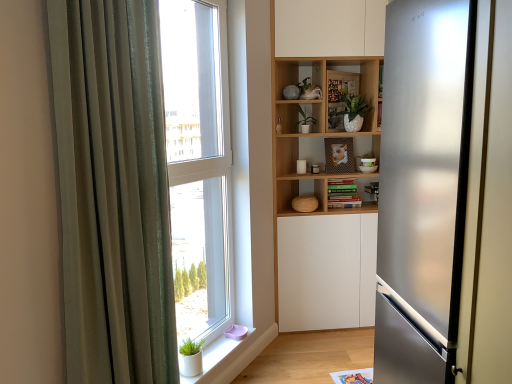
Question: Is transparent glass window at center turned away from white matte window sill at lower left?

Choices:
 (A) yes
 (B) no

Answer: (B)

Question: Is transparent glass window at center bigger than white matte window sill at lower left?

Choices:
 (A) no
 (B) yes

Answer: (B)

Question: Can you confirm if transparent glass window at center is smaller than white matte window sill at lower left?

Choices:
 (A) no
 (B) yes

Answer: (A)

Question: Are transparent glass window at center and white matte window sill at lower left far apart?

Choices:
 (A) yes
 (B) no

Answer: (B)

Question: Is transparent glass window at center touching white matte window sill at lower left?

Choices:
 (A) yes
 (B) no

Answer: (B)

Question: Is transparent glass window at center behind white matte window sill at lower left?

Choices:
 (A) yes
 (B) no

Answer: (B)

Question: Can you confirm if green matte plant at center, the second plant in the right-to-left sequence, is positioned to the left of green matte plant at upper center, marked as the second plant in a left-to-right arrangement?

Choices:
 (A) yes
 (B) no

Answer: (A)

Question: Is green matte plant at center, the second plant in the right-to-left sequence, facing away from green matte plant at upper center, marked as the second plant in a left-to-right arrangement?

Choices:
 (A) yes
 (B) no

Answer: (B)

Question: Is green matte plant at center, which is the first plant from left to right, surrounding green matte plant at upper center, the 1th plant from the right?

Choices:
 (A) yes
 (B) no

Answer: (B)

Question: Is green matte plant at center, the second plant in the right-to-left sequence, positioned beyond the bounds of green matte plant at upper center, marked as the second plant in a left-to-right arrangement?

Choices:
 (A) yes
 (B) no

Answer: (A)

Question: Considering the relative sizes of green matte plant at center, which is the first plant from left to right, and green matte plant at upper center, the 1th plant from the right, in the image provided, is green matte plant at center, which is the first plant from left to right, smaller than green matte plant at upper center, the 1th plant from the right,?

Choices:
 (A) no
 (B) yes

Answer: (B)

Question: Considering the relative positions of green matte plant at center, the second plant in the right-to-left sequence, and green matte plant at upper center, the 1th plant from the right, in the image provided, is green matte plant at center, the second plant in the right-to-left sequence, in front of green matte plant at upper center, the 1th plant from the right,?

Choices:
 (A) yes
 (B) no

Answer: (B)

Question: Is satin silver refrigerator at right shorter than green matte plant at center, the second plant in the right-to-left sequence?

Choices:
 (A) yes
 (B) no

Answer: (B)